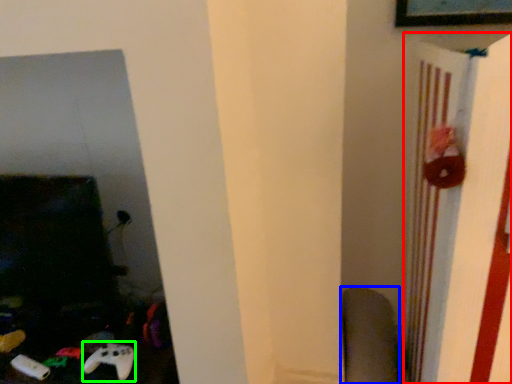
Question: Which object is the farthest from bulletin board (highlighted by a red box)? Choose among these: swivel chair (highlighted by a blue box) or game controller (highlighted by a green box).

Choices:
 (A) swivel chair
 (B) game controller

Answer: (B)